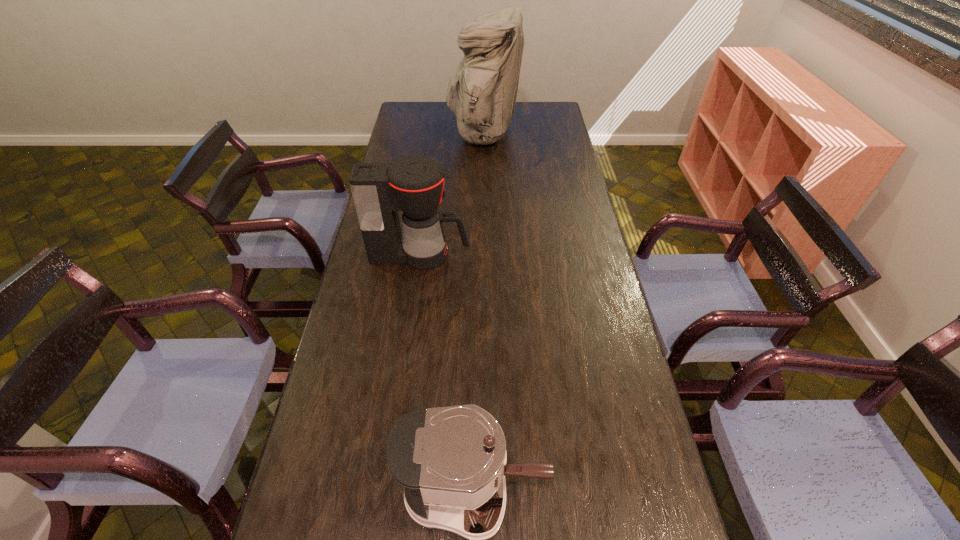
Where is `the farthest object`? The image size is (960, 540). the farthest object is located at coordinates (482, 91).

The width and height of the screenshot is (960, 540). Identify the location of backpack. (482, 91).

This screenshot has width=960, height=540. Find the location of `the second tallest object`. the second tallest object is located at coordinates 414,185.

Identify the location of the second farthest object. (414, 185).

Identify the location of vacant region located 0.180m on the front-facing side of the tallest object. The height and width of the screenshot is (540, 960). (411, 134).

At what (x,y) coordinates should I click in order to perform the action: click on free space located on the front-facing side of the tallest object. Please return your answer as a coordinate pair (x, y). Looking at the image, I should click on (426, 134).

Find the location of a particular element. free space located 0.240m on the front-facing side of the tallest object is located at coordinates (398, 134).

Where is `free space located pour from the carafe of the second shortest object`? This screenshot has height=540, width=960. free space located pour from the carafe of the second shortest object is located at coordinates (572, 255).

You are a GUI agent. You are given a task and a screenshot of the screen. Output one action in this format:
    pyautogui.click(x=<x>, y=<y>)
    Task: Click on the object that is at the far edge
    
    Given the screenshot: What is the action you would take?
    pyautogui.click(x=482, y=91)

Find the location of `object situated at the left edge`. object situated at the left edge is located at coordinates (414, 185).